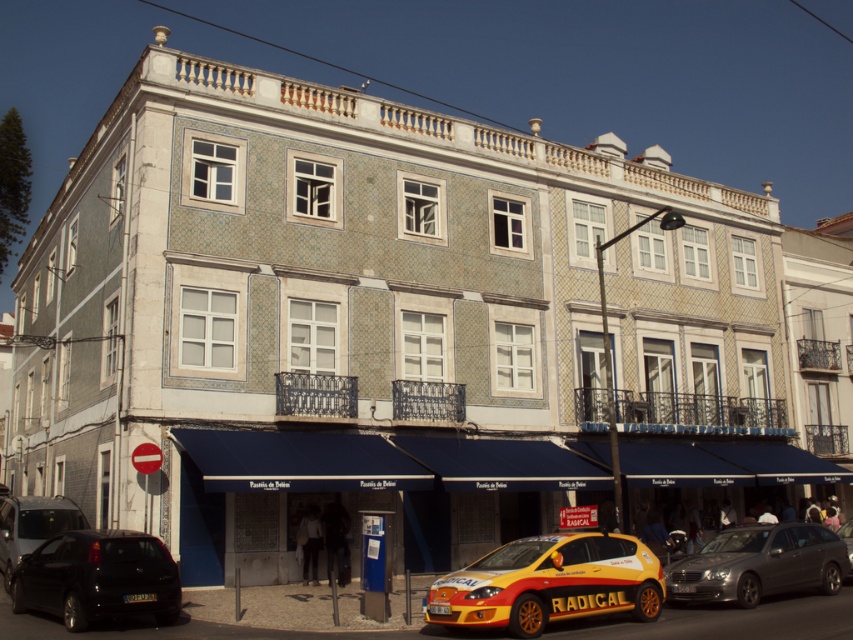
You are standing at the entrance of the shop on the ground floor of the building. You see a point marked at coordinates point (32, 525). What object is located at this point?

The point (32, 525) corresponds to the matte black van at lower left.